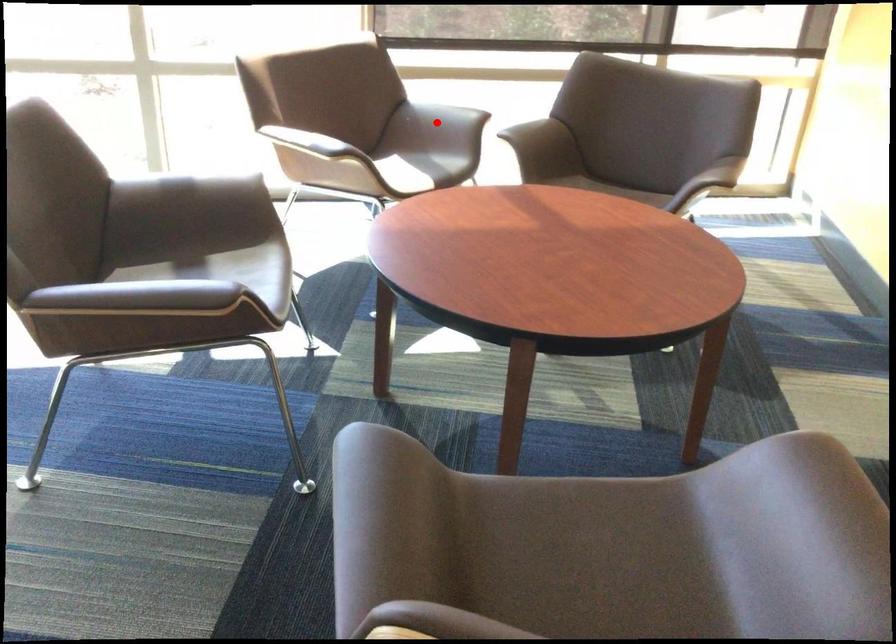
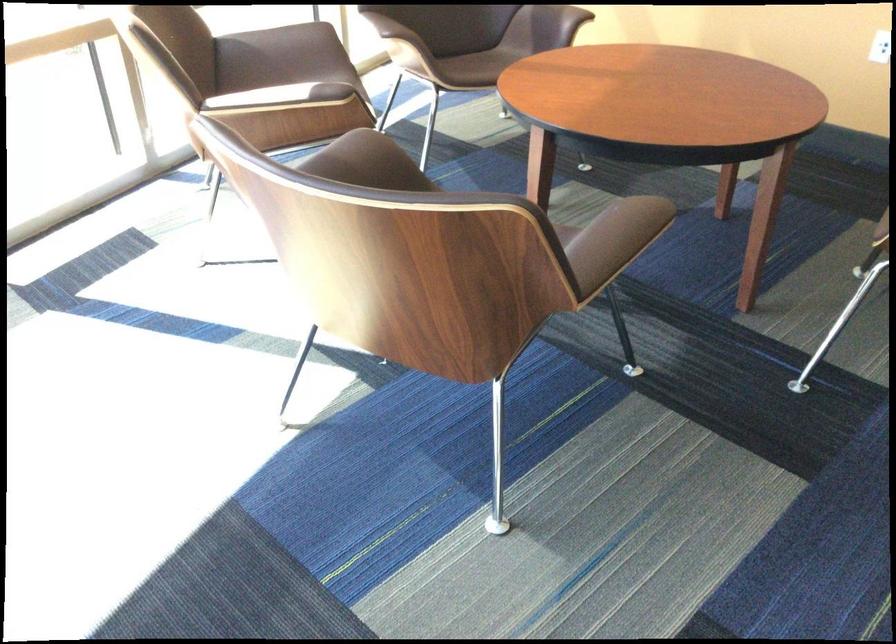
Question: I am providing you with two images of the same scene from different viewpoints. Given a red point in image1, look at the same physical point in image2. Is it:

Choices:
 (A) Closer to the viewpoint
 (B) Farther from the viewpoint

Answer: (A)